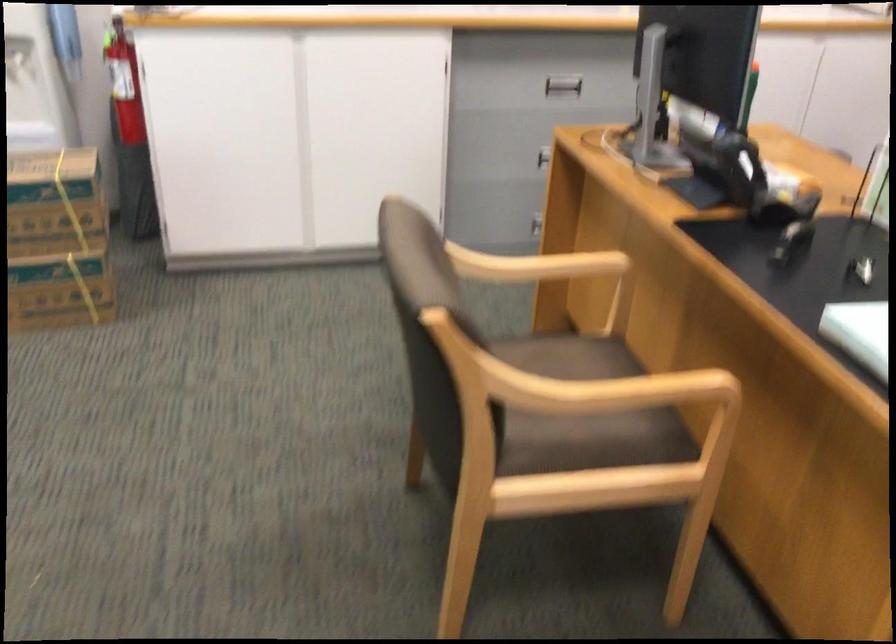
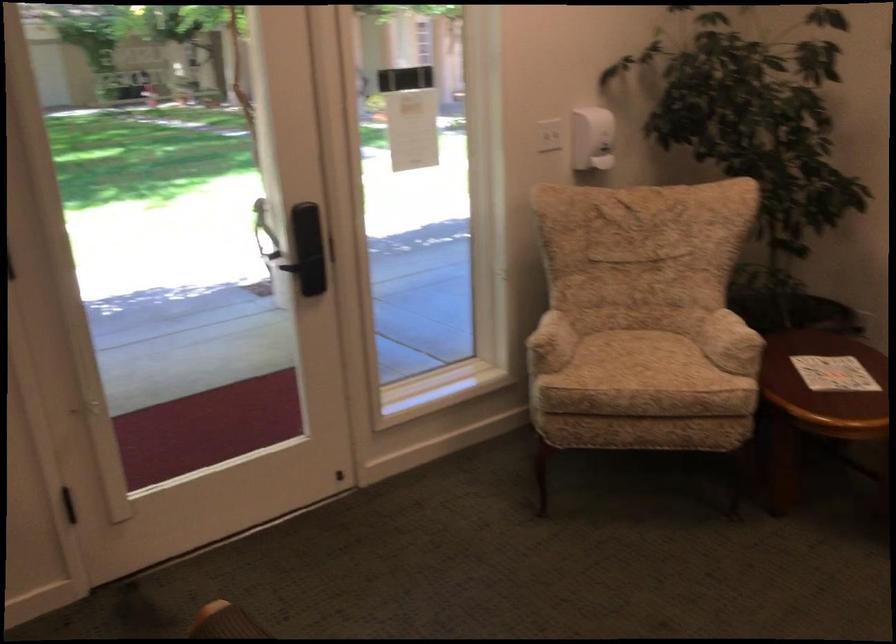
Question: The camera is either moving clockwise (left) or counter-clockwise (right) around the object. The first image is from the beginning of the video and the second image is from the end. Is the camera moving left or right when shooting the video?

Choices:
 (A) Left
 (B) Right

Answer: (B)